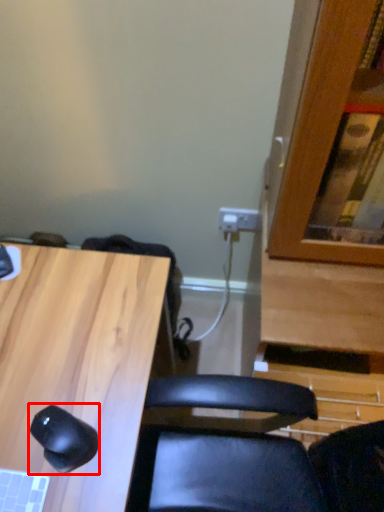
Question: From the image's perspective, where is mouse (annotated by the red box) located relative to desk?

Choices:
 (A) above
 (B) below

Answer: (A)